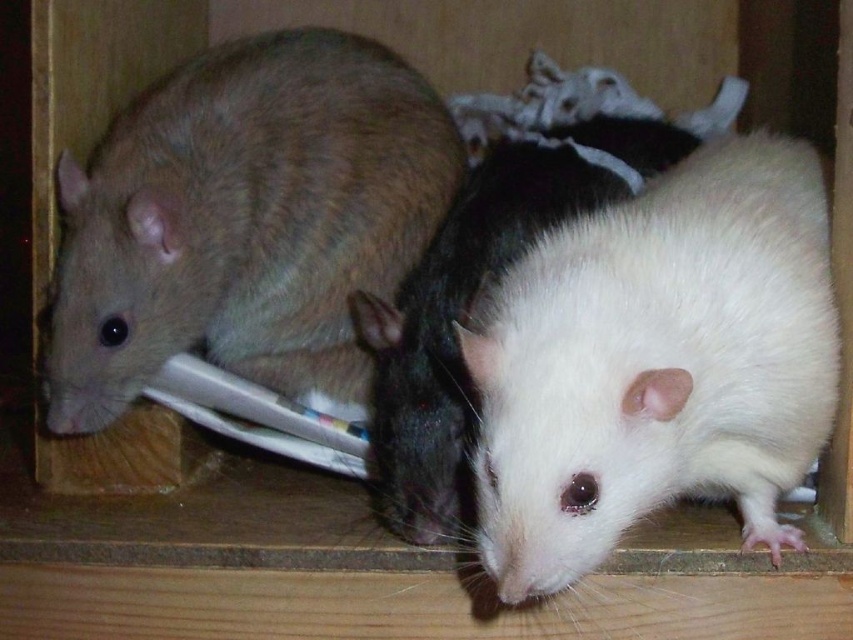
You are a researcher observing the enclosure. You notice the matte brown mouse at left and the white matte fur mouse at center. Which mouse is positioned higher in the enclosure?

The matte brown mouse at left is positioned higher in the enclosure than the white matte fur mouse at center because it is above it.

Where is the matte brown mouse at left located in the image?

The matte brown mouse at left is located at point (247, 220) in the image.

You are standing in front of the wooden enclosure with two points marked inside it. The points are labeled as point 1 and point 2. Point 1 is at coordinates [427,221] and point 2 is at [434,419]. If you want to place a treat closer to the front of the enclosure, which point should you choose?

Point 1 at coordinates [427,221] is closer to the front of the enclosure, so you should place the treat there.